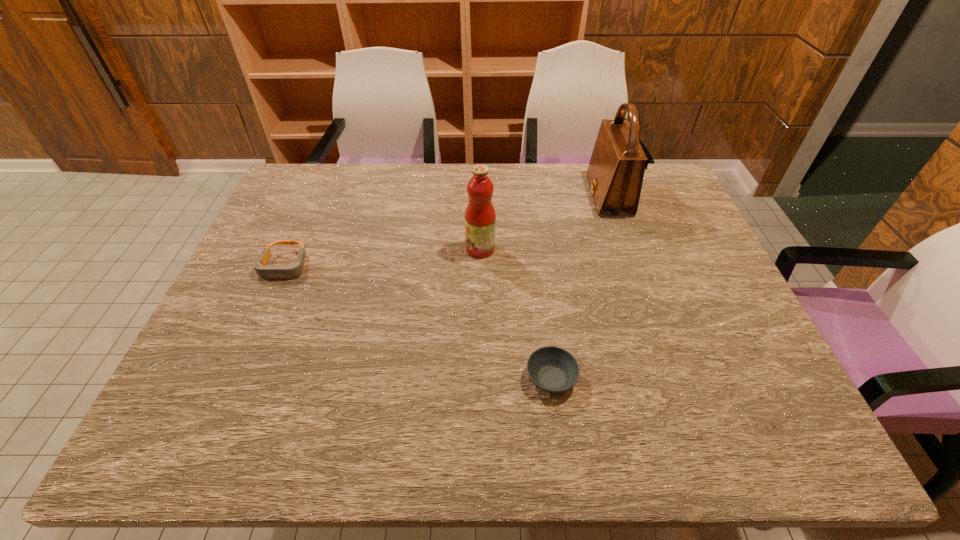
What are the coordinates of `vacant space that satisfies the following two spatial constraints: 1. on the front label of the fruit juice; 2. on the front and back of the leftmost object` in the screenshot? It's located at (480, 267).

Where is `free space that satisfies the following two spatial constraints: 1. on the front flap of the farthest object; 2. on the front and back of the leftmost object`? The image size is (960, 540). free space that satisfies the following two spatial constraints: 1. on the front flap of the farthest object; 2. on the front and back of the leftmost object is located at coordinates (633, 267).

Locate an element on the screen. free space that satisfies the following two spatial constraints: 1. on the front and back of the soup bowl; 2. on the left side of the goggles is located at coordinates (235, 379).